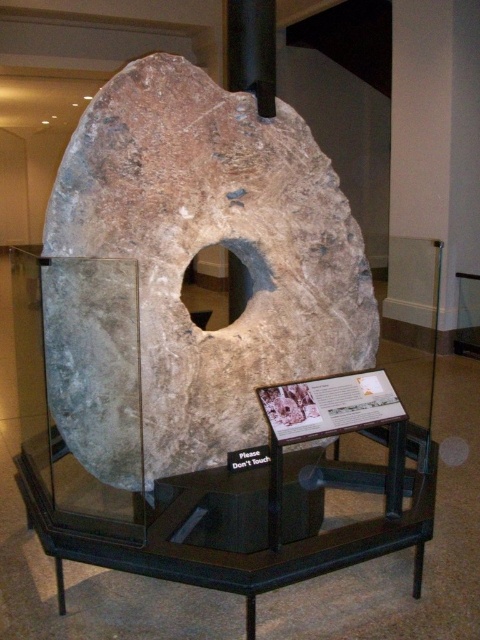
Consider the image. You are a visitor at the museum and want to take a photo of the speckled stone disk at center and the brown rough stone hole at center. Which object should you focus on first if you want to capture both in the same frame without moving the camera?

You should focus on the speckled stone disk at center first because it is positioned under the brown rough stone hole at center, so adjusting focus to the closer object will ensure both are in the frame.

You are a museum visitor standing in front of the display case. You see a point marked at coordinates (213, 243). Which object in the display does this point belong to?

The point at coordinates (213, 243) belongs to the speckled stone disk at center.

You are standing in front of the ancient stone artifact in the museum. There are two points marked on the display case. Which point, point [166,230] or point [224,248], is closer to you?

Point [166,230] is closer to the viewer than point [224,248].